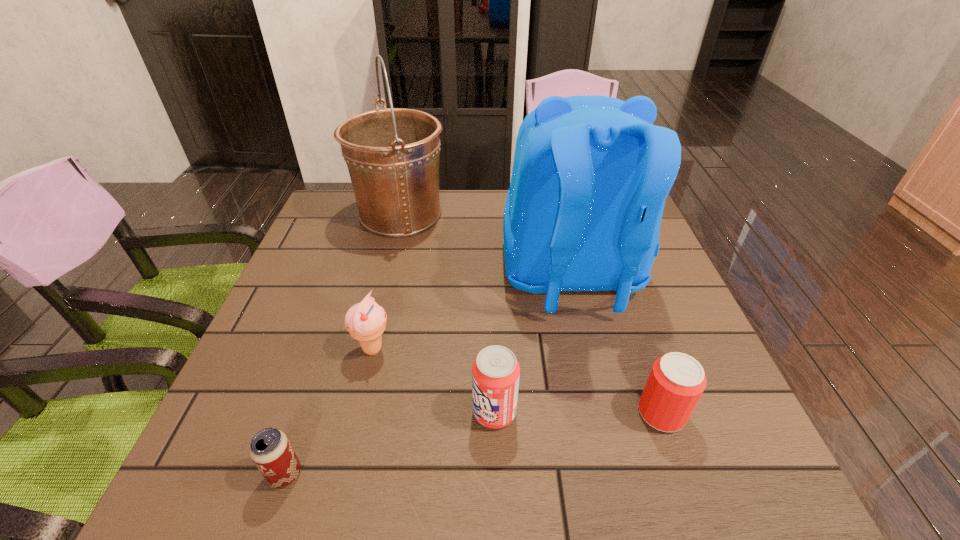
Where is `object that stands as the fourth closest to the nearest object`? object that stands as the fourth closest to the nearest object is located at coordinates (676, 382).

Where is `free location that satisfies the following two spatial constraints: 1. on the surface of the soda can; 2. on the front side of the left beer can`? This screenshot has width=960, height=540. free location that satisfies the following two spatial constraints: 1. on the surface of the soda can; 2. on the front side of the left beer can is located at coordinates (496, 474).

The height and width of the screenshot is (540, 960). I want to click on free space that satisfies the following two spatial constraints: 1. on the surface of the soda can; 2. on the front side of the nearest object, so click(x=496, y=474).

This screenshot has width=960, height=540. Find the location of `free point that satisfies the following two spatial constraints: 1. on the front side of the bucket; 2. on the right side of the third farthest object`. free point that satisfies the following two spatial constraints: 1. on the front side of the bucket; 2. on the right side of the third farthest object is located at coordinates (368, 349).